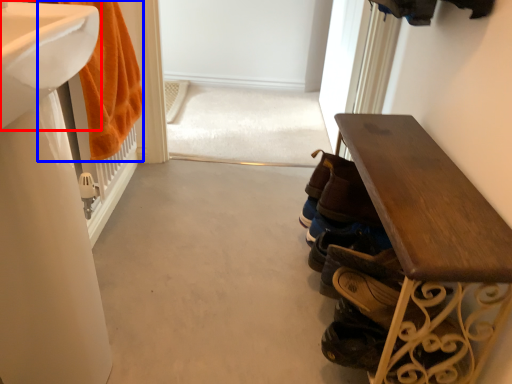
Question: Which object is further to the camera taking this photo, sink (highlighted by a red box) or bath towel (highlighted by a blue box)?

Choices:
 (A) sink
 (B) bath towel

Answer: (B)